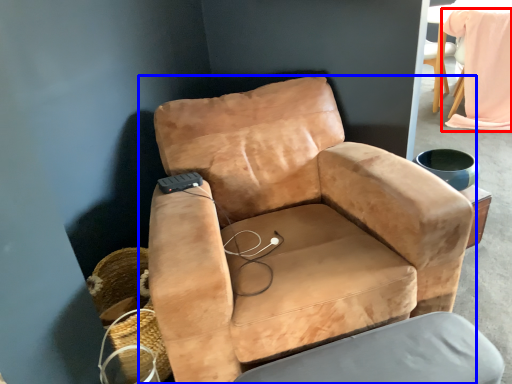
Question: Which point is closer to the camera, bean bag chair (highlighted by a red box) or chair (highlighted by a blue box)?

Choices:
 (A) bean bag chair
 (B) chair

Answer: (B)